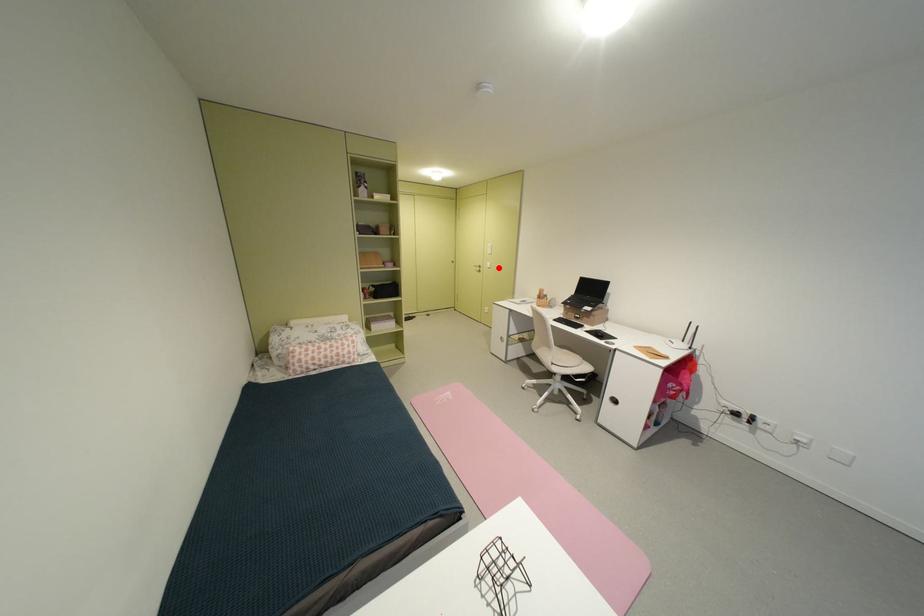
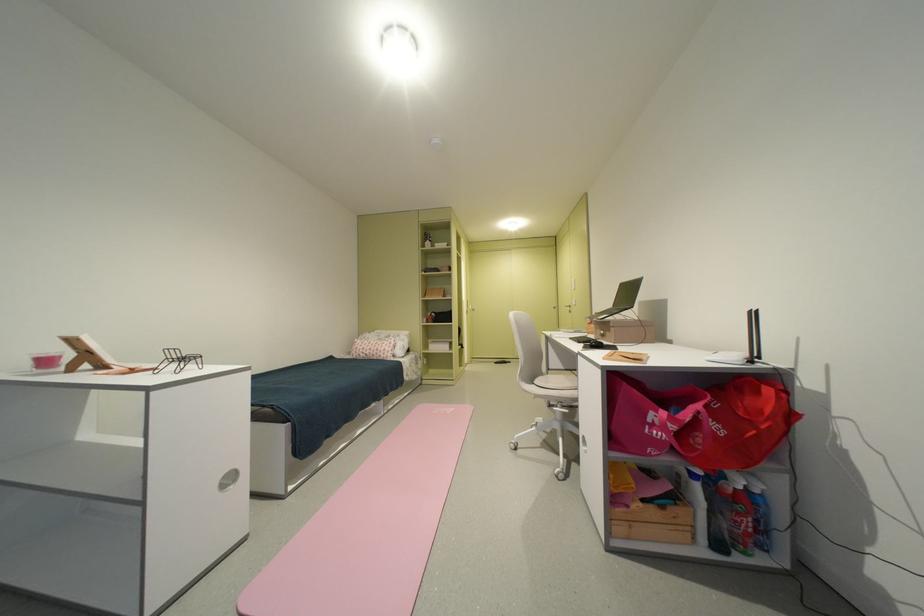
Where in the second image is the point corresponding to the highlighted location from the first image?

(584, 305)